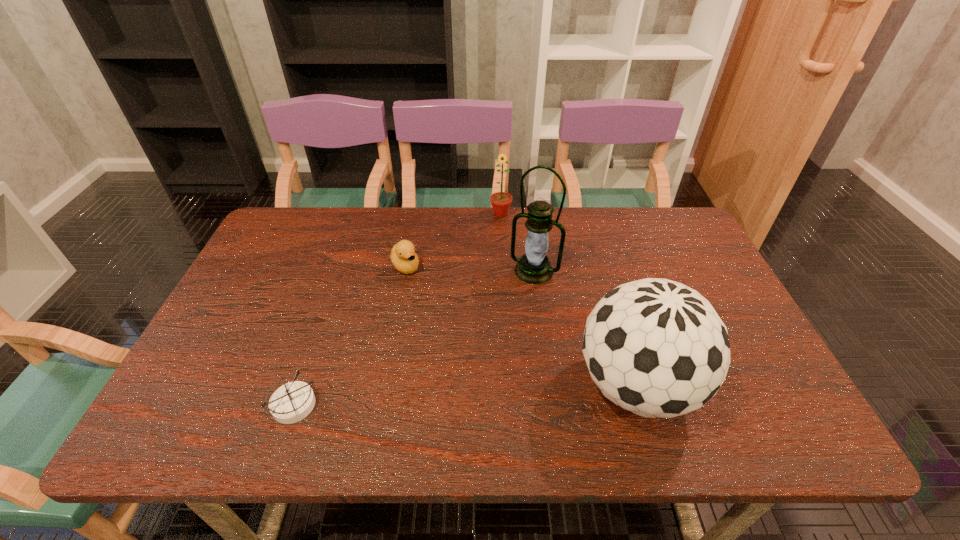
Locate an element on the screen. This screenshot has height=540, width=960. free area in between the duckling and the fourth shortest object is located at coordinates (520, 326).

Locate an element on the screen. This screenshot has width=960, height=540. empty space that is in between the fourth tallest object and the second tallest object is located at coordinates (520, 326).

In order to click on vacant area between the tallest object and the compass in this screenshot , I will do `click(414, 339)`.

This screenshot has width=960, height=540. What are the coordinates of `free space between the second shortest object and the compass` in the screenshot? It's located at (349, 336).

Locate an element on the screen. The height and width of the screenshot is (540, 960). free point between the second tallest object and the third tallest object is located at coordinates (568, 300).

This screenshot has width=960, height=540. In order to click on vacant space that is in between the tallest object and the sunflower in this screenshot , I will do `click(517, 242)`.

Identify the location of vacant space that's between the shortest object and the soccer ball. (465, 396).

Locate an element on the screen. The height and width of the screenshot is (540, 960). object that is the closest to the tallest object is located at coordinates (657, 348).

Where is `object that is the fourth closest to the tallest object`? object that is the fourth closest to the tallest object is located at coordinates (292, 402).

At what (x,y) coordinates should I click in order to perform the action: click on free spot that satisfies the following two spatial constraints: 1. on the back side of the second tallest object; 2. on the right side of the leftmost object. Please return your answer as a coordinate pair (x, y). This screenshot has width=960, height=540. Looking at the image, I should click on (300, 386).